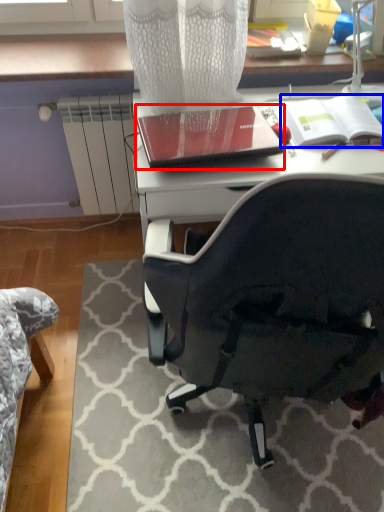
Question: Which object is closer to the camera taking this photo, notebook (highlighted by a red box) or notebook (highlighted by a blue box)?

Choices:
 (A) notebook
 (B) notebook

Answer: (A)